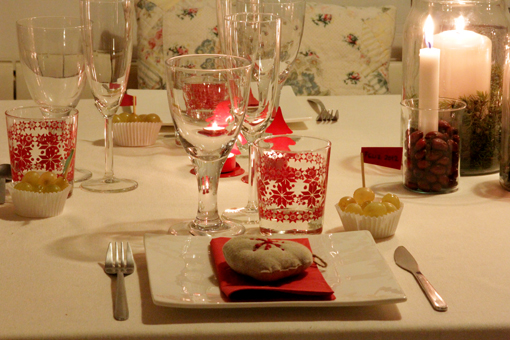
Locate an element on the screen. The image size is (510, 340). flower detail is located at coordinates (329, 19), (357, 32), (353, 70), (312, 53), (190, 7), (172, 47), (224, 28), (143, 10), (150, 48).